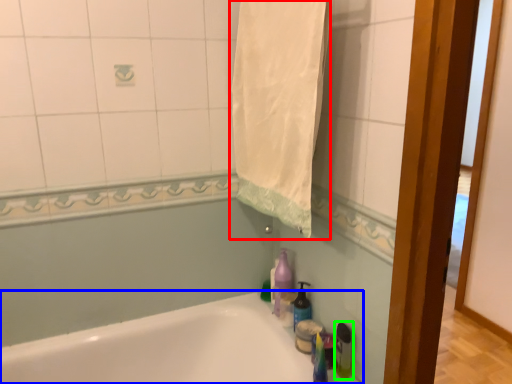
Question: Which object is positioned farthest from bath towel (highlighted by a red box)? Select from bathtub (highlighted by a blue box) and bottle (highlighted by a green box).

Choices:
 (A) bathtub
 (B) bottle

Answer: (A)